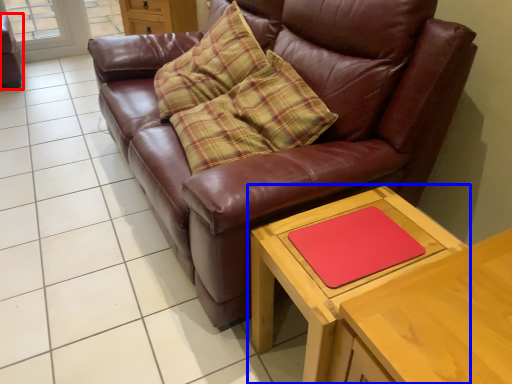
Question: Which object is closer to the camera taking this photo, swivel chair (highlighted by a red box) or table (highlighted by a blue box)?

Choices:
 (A) swivel chair
 (B) table

Answer: (B)